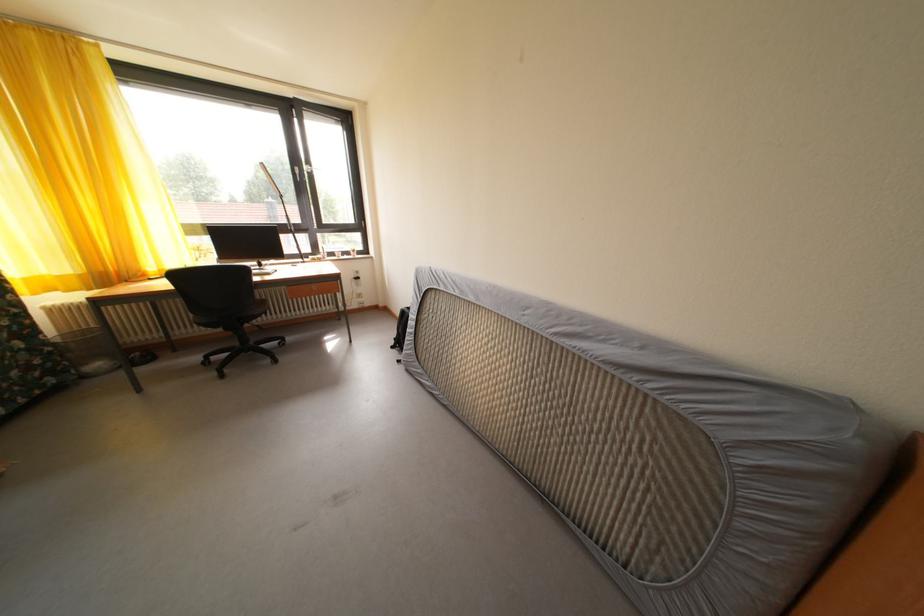
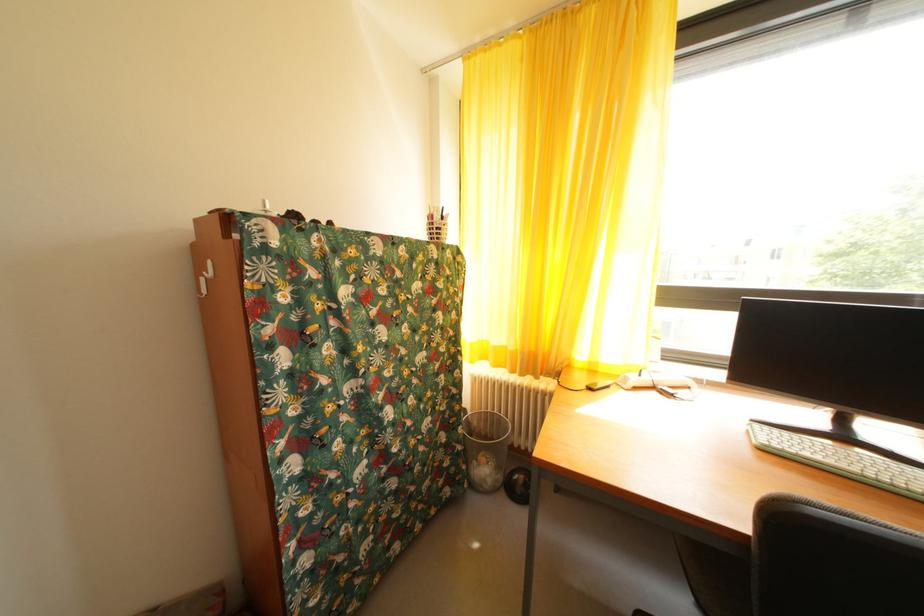
Where in the second image is the point corresponding to (71,283) from the first image?

(505, 354)